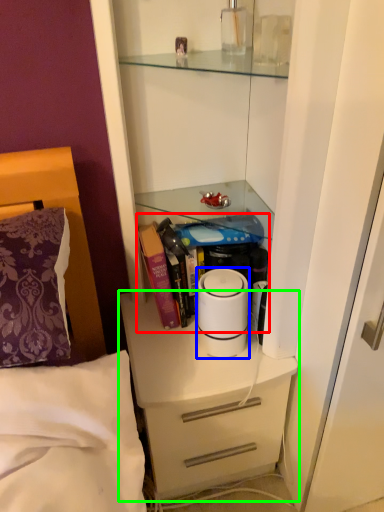
Question: Which is nearer to the book (highlighted by a red box)? home appliance (highlighted by a blue box) or chest of drawers (highlighted by a green box).

Choices:
 (A) home appliance
 (B) chest of drawers

Answer: (A)